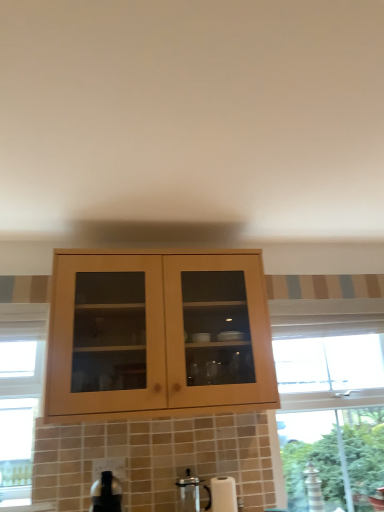
Question: From a real-world perspective, is satin silver kettle at lower center above or below satin silver coffee machine at lower center?

Choices:
 (A) above
 (B) below

Answer: (A)

Question: Looking at their shapes, would you say satin silver kettle at lower center is wider or thinner than satin silver coffee machine at lower center?

Choices:
 (A) thin
 (B) wide

Answer: (B)

Question: Is satin silver kettle at lower center to the left or to the right of satin silver coffee machine at lower center in the image?

Choices:
 (A) left
 (B) right

Answer: (A)

Question: Considering their positions, is satin silver coffee machine at lower center located in front of or behind satin silver kettle at lower center?

Choices:
 (A) front
 (B) behind

Answer: (B)

Question: From the image's perspective, is satin silver coffee machine at lower center positioned above or below satin silver kettle at lower center?

Choices:
 (A) below
 (B) above

Answer: (A)

Question: From their relative heights in the image, would you say satin silver coffee machine at lower center is taller or shorter than satin silver kettle at lower center?

Choices:
 (A) tall
 (B) short

Answer: (A)

Question: Is satin silver coffee machine at lower center to the left or to the right of satin silver kettle at lower center in the image?

Choices:
 (A) right
 (B) left

Answer: (A)